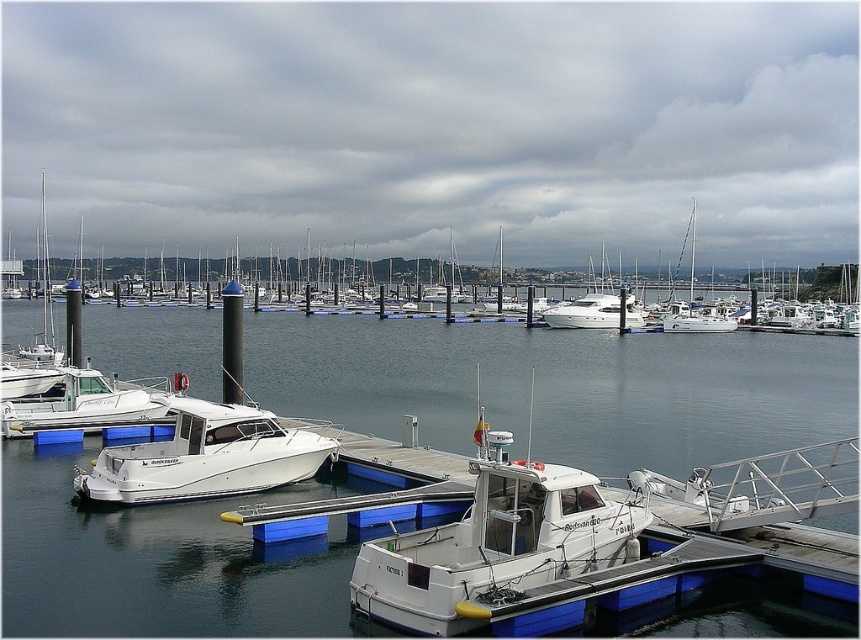
Question: From the image, what is the correct spatial relationship of white glossy boat at lower left in relation to white glossy yacht at center?

Choices:
 (A) above
 (B) below

Answer: (B)

Question: Which object appears farthest from the camera in this image?

Choices:
 (A) white glossy boat at lower left
 (B) white glossy boat at center

Answer: (A)

Question: Which point is closer to the camera taking this photo?

Choices:
 (A) (691, 317)
 (B) (274, 484)

Answer: (B)

Question: Does white glossy yacht at center appear on the right side of white glossy sailboat at upper center?

Choices:
 (A) no
 (B) yes

Answer: (A)

Question: Which point is closer to the camera?

Choices:
 (A) (683, 308)
 (B) (612, 522)
 (C) (134, 416)
 (D) (34, 579)

Answer: (B)

Question: Does clear water at dock center appear over white glossy boat at lower left?

Choices:
 (A) no
 (B) yes

Answer: (B)